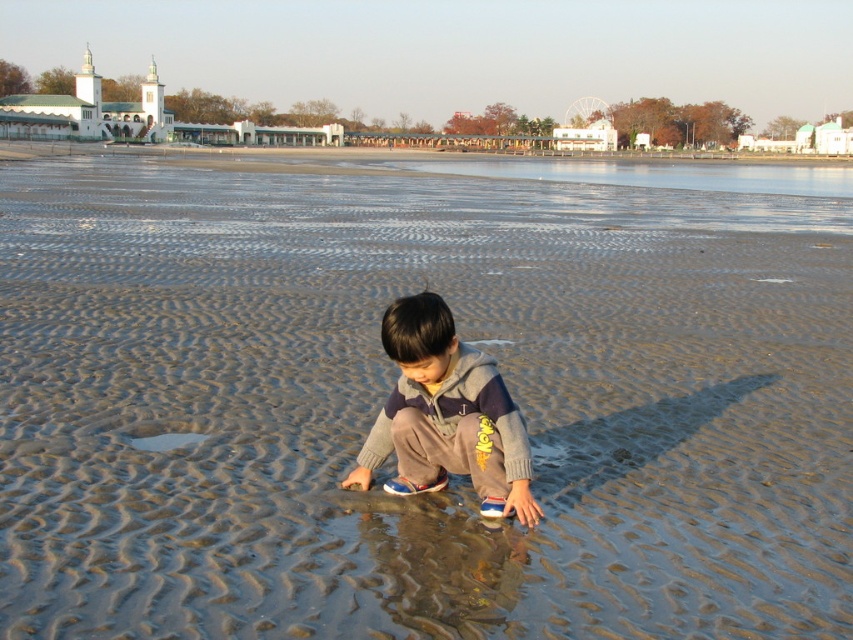
Question: Which of these objects is positioned closest to the clear water at lower left?

Choices:
 (A) gray fleece jacket at center
 (B) clear water at upper center

Answer: (A)

Question: Which object appears closest to the camera in this image?

Choices:
 (A) clear water at upper center
 (B) gray fleece jacket at center

Answer: (B)

Question: Can you confirm if gray fleece jacket at center is thinner than clear water at upper center?

Choices:
 (A) no
 (B) yes

Answer: (B)

Question: Does gray fleece jacket at center have a larger size compared to clear water at lower left?

Choices:
 (A) yes
 (B) no

Answer: (A)

Question: Can you confirm if clear water at upper center is positioned below clear water at lower left?

Choices:
 (A) no
 (B) yes

Answer: (A)

Question: Which of these objects is positioned closest to the clear water at upper center?

Choices:
 (A) gray fleece jacket at center
 (B) clear water at lower left

Answer: (A)